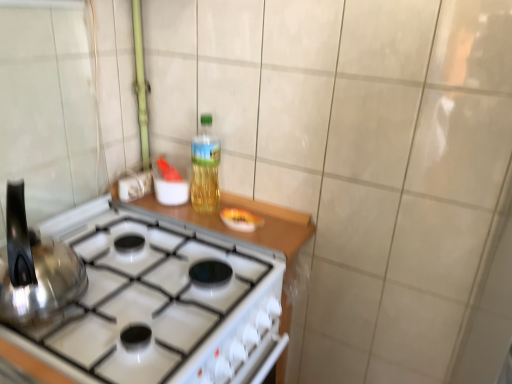
Locate an element on the screen. This screenshot has height=384, width=512. vacant space to the right of translucent plastic bottle at center is located at coordinates (267, 220).